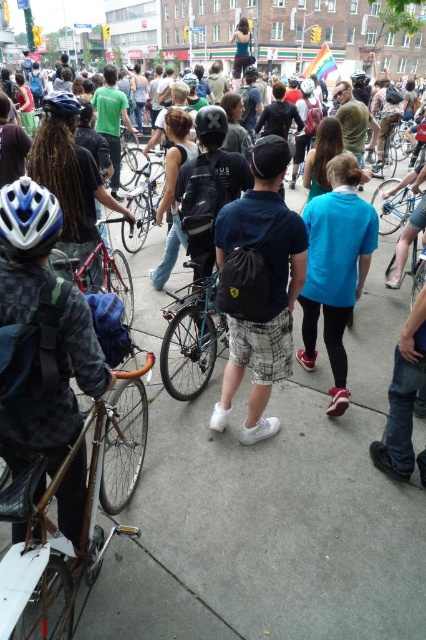
Question: Is matte black helmet at left bigger than blue metallic bicycle at center right?

Choices:
 (A) yes
 (B) no

Answer: (B)

Question: Among these objects, which one is nearest to the camera?

Choices:
 (A) black matte bicycle helmet at center
 (B) gold metallic bicycle at left
 (C) matte black helmet at center
 (D) matte black backpack at center

Answer: (B)

Question: Is white matte bicycle helmet at left bigger than shiny red bicycle at left?

Choices:
 (A) yes
 (B) no

Answer: (B)

Question: Which of the following is the farthest from the observer?

Choices:
 (A) (192, 84)
 (B) (362, 77)

Answer: (A)

Question: Does matte black helmet at left have a larger size compared to shiny silver bicycle at center?

Choices:
 (A) no
 (B) yes

Answer: (A)

Question: Which point is farther to the camera?

Choices:
 (A) (379, 204)
 (B) (368, 216)
 (C) (16, 227)

Answer: (A)